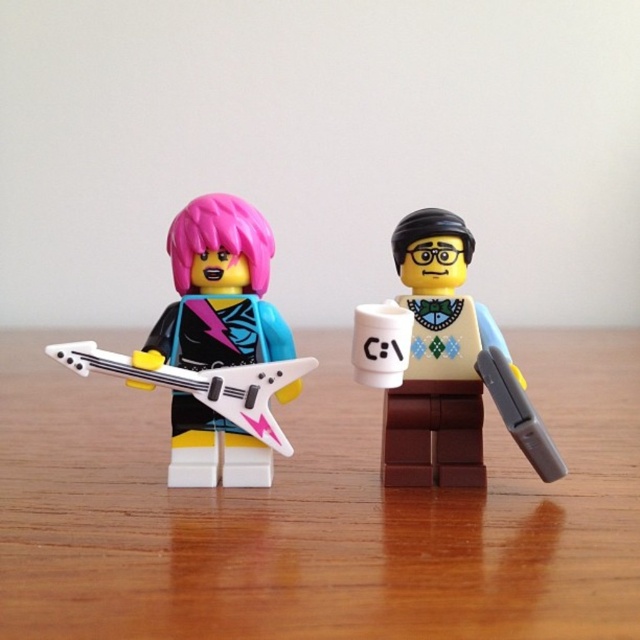
Question: Is matte brown briefcase at right above white plastic guitar at left?

Choices:
 (A) no
 (B) yes

Answer: (B)

Question: Is wooden table at center to the left of matte brown briefcase at right from the viewer's perspective?

Choices:
 (A) no
 (B) yes

Answer: (B)

Question: Which object appears farthest from the camera in this image?

Choices:
 (A) matte black guitar at left
 (B) white plastic guitar at left

Answer: (A)

Question: Which of the following is the farthest from the observer?

Choices:
 (A) white plastic guitar at left
 (B) wooden table at center

Answer: (A)

Question: Which point is farther from the camera taking this photo?

Choices:
 (A) tap(68, 461)
 (B) tap(227, 460)

Answer: (A)

Question: Is matte brown briefcase at right to the right of white plastic guitar at left from the viewer's perspective?

Choices:
 (A) yes
 (B) no

Answer: (A)